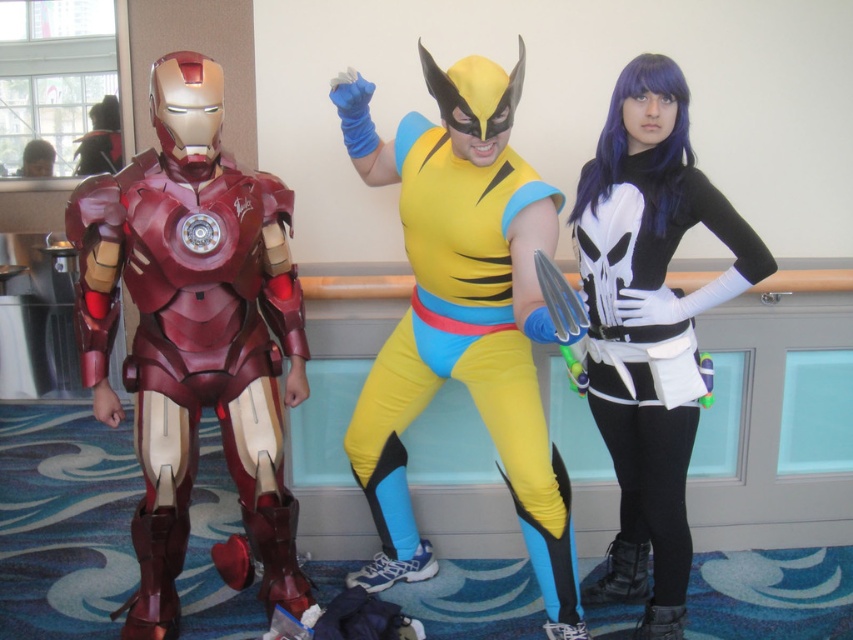
Does yellow spandex suit at center have a lesser width compared to black matte punisher costume at right?

No.

The width and height of the screenshot is (853, 640). I want to click on yellow spandex suit at center, so click(462, 316).

Who is more forward, (x=212, y=198) or (x=447, y=77)?

Positioned in front is point (x=447, y=77).

Is point (241, 532) positioned in front of point (428, 337)?

No, (241, 532) is further to viewer.

Find the location of a particular element. shiny metallic armor at left is located at coordinates (195, 337).

Does shiny metallic armor at left have a larger size compared to black matte punisher costume at right?

Yes.

Between shiny metallic armor at left and black matte punisher costume at right, which one appears on the left side from the viewer's perspective?

shiny metallic armor at left is more to the left.

Is point (138, 344) positioned in front of point (621, 164)?

Yes, point (138, 344) is closer to viewer.

You are a GUI agent. You are given a task and a screenshot of the screen. Output one action in this format:
    pyautogui.click(x=<x>, y=<y>)
    Task: Click on the shiny metallic armor at left
    The image size is (853, 640).
    Given the screenshot: What is the action you would take?
    pyautogui.click(x=195, y=337)